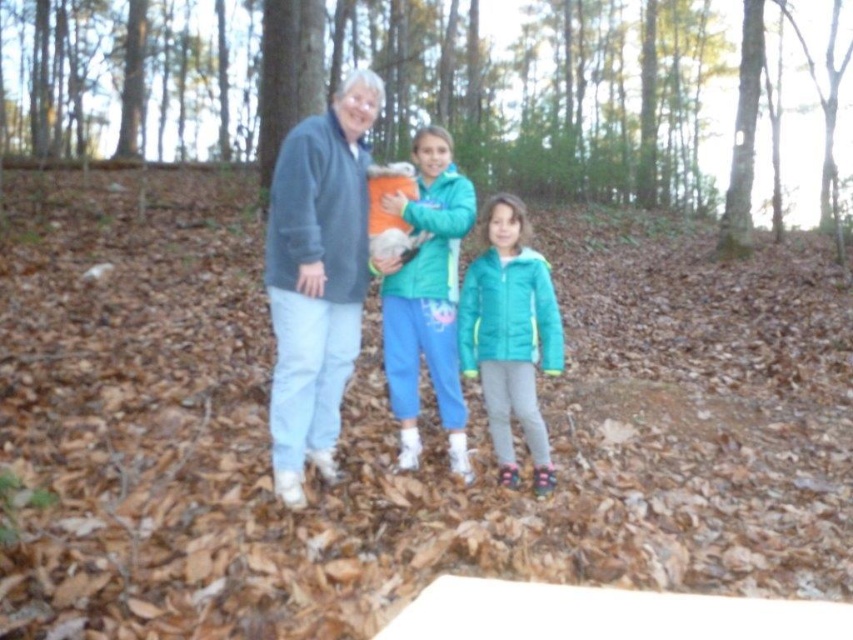
You are standing at point (425,152) and want to walk to the forest exit located at point (282,368). Considering the terrain described in the scene, is the path from your current position to the exit relatively straightforward?

The path from point (425,152) to point (282,368) is straightforward because point (282,368) is in front of point (425,152), indicating a direct forward path without needing to move sideways or backward.

You are trying to decide which jacket to wear for a walk in the forest. You see the soft fleece jacket at center and the teal fleece jacket at center. Which one is on the left side?

The soft fleece jacket at center is positioned on the left side of the teal fleece jacket at center.

You are planning to place the soft fleece jacket at center on top of the brown leaf litter at center. Considering their sizes, will the jacket fully cover the leaf litter?

The brown leaf litter at center is wider than the soft fleece jacket at center, so the jacket will not fully cover the leaf litter.